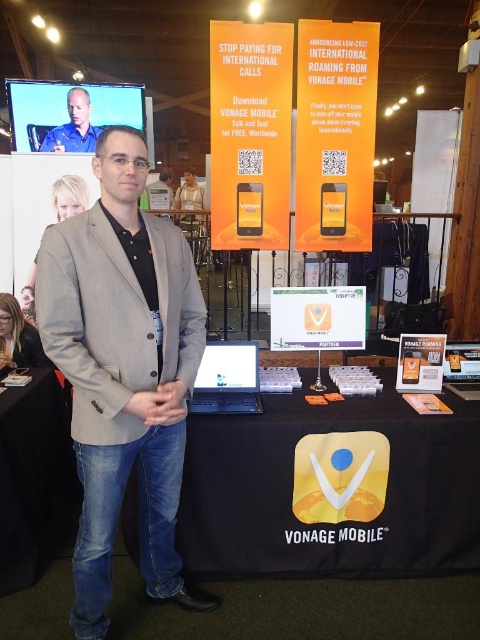
Question: Can you confirm if black fabric table at center is positioned above gray fabric blazer at center?

Choices:
 (A) no
 (B) yes

Answer: (A)

Question: Can you confirm if black fabric table at center is positioned above matte blue shirt at upper left?

Choices:
 (A) no
 (B) yes

Answer: (A)

Question: Which point is closer to the camera?

Choices:
 (A) (68, 141)
 (B) (391, 461)
 (C) (92, 484)

Answer: (C)

Question: Is black fabric table at center positioned before matte blue shirt at upper left?

Choices:
 (A) no
 (B) yes

Answer: (B)

Question: Which point is closer to the camera?

Choices:
 (A) matte blue shirt at upper left
 (B) gray fabric blazer at center
 (C) black fabric table at center

Answer: (B)

Question: Which point is farther to the camera?

Choices:
 (A) (458, 509)
 (B) (130, 401)

Answer: (A)